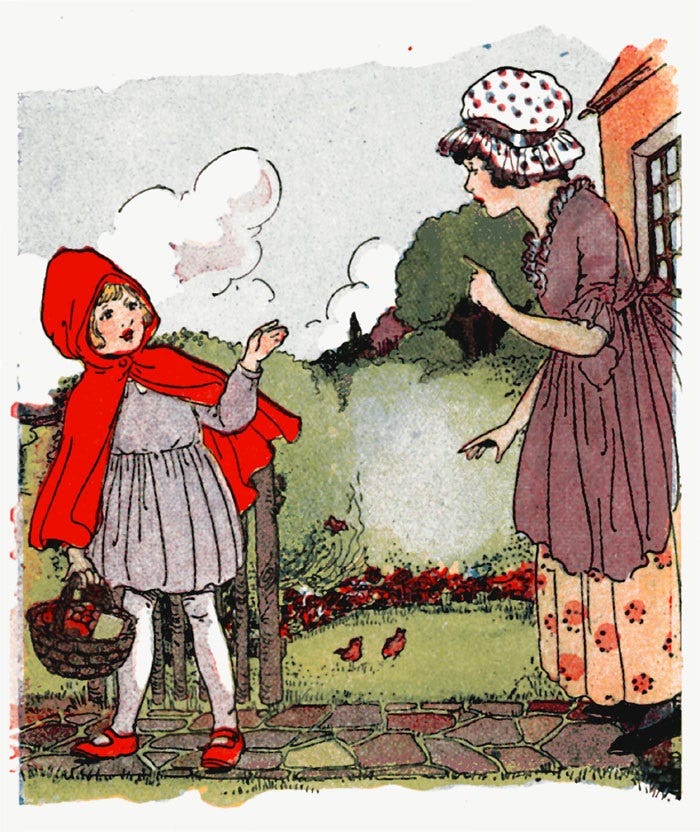
Where is `basket`? The height and width of the screenshot is (832, 700). basket is located at coordinates (57, 651).